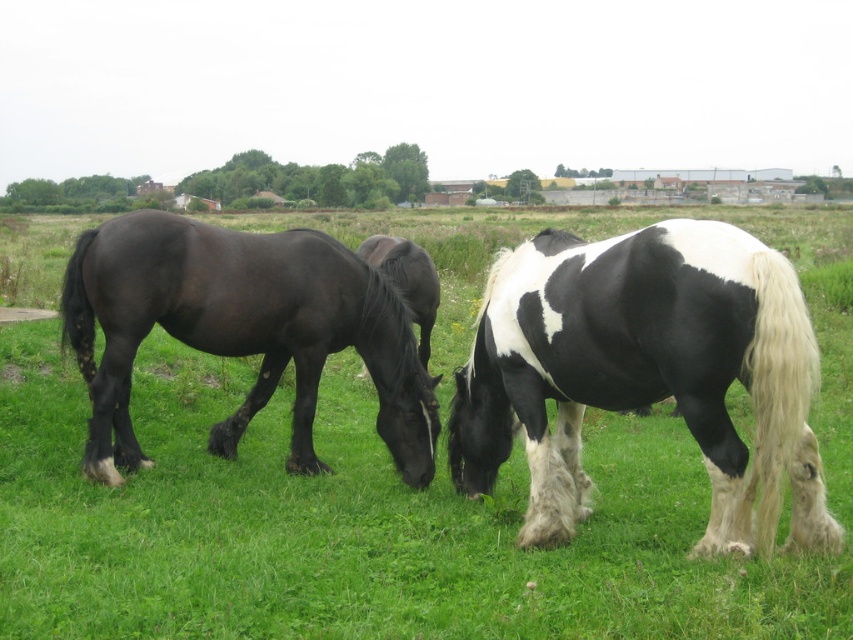
Question: From the image, what is the correct spatial relationship of black and white speckled coat at center in relation to shiny black horse at center?

Choices:
 (A) right
 (B) left

Answer: (A)

Question: Is green grass at center to the left of shiny black horse at left from the viewer's perspective?

Choices:
 (A) no
 (B) yes

Answer: (A)

Question: Which point is farther to the camera?

Choices:
 (A) shiny black horse at center
 (B) shiny black horse at left
 (C) black and white speckled coat at center
 (D) green grass at center

Answer: (A)

Question: Which object is positioned closest to the green grass at center?

Choices:
 (A) shiny black horse at left
 (B) shiny black horse at center
 (C) black and white speckled coat at center

Answer: (A)

Question: Which is farther from the black and white speckled coat at center?

Choices:
 (A) shiny black horse at left
 (B) green grass at center
 (C) shiny black horse at center

Answer: (B)

Question: Does black and white speckled coat at center lie in front of shiny black horse at left?

Choices:
 (A) no
 (B) yes

Answer: (B)